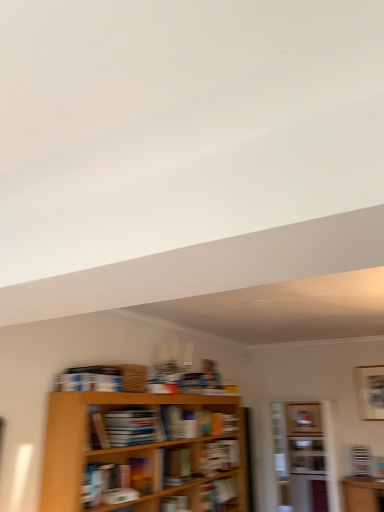
Question: From a real-world perspective, is white glossy cabinet at center located beneath hardcover book at center, which appears as the 5th book when viewed from the left?

Choices:
 (A) yes
 (B) no

Answer: (B)

Question: Is the depth of white glossy cabinet at center greater than that of hardcover book at center, placed as the 3th book when sorted from back to front?

Choices:
 (A) no
 (B) yes

Answer: (B)

Question: Does white glossy cabinet at center have a lesser height compared to hardcover book at center, which appears as the 5th book when viewed from the left?

Choices:
 (A) yes
 (B) no

Answer: (B)

Question: From the image's perspective, does white glossy cabinet at center appear lower than hardcover book at center, which appears as the 5th book when viewed from the left?

Choices:
 (A) yes
 (B) no

Answer: (A)

Question: Is white glossy cabinet at center directly adjacent to hardcover book at center, which is the fourth book from front to back?

Choices:
 (A) no
 (B) yes

Answer: (A)

Question: Is white glossy cabinet at center facing away from hardcover book at center, which is the fourth book from front to back?

Choices:
 (A) yes
 (B) no

Answer: (B)

Question: Is matte brown book at center, the 4th book positioned from the right, in front of hardcover book at center, placed as the 3th book when sorted from back to front?

Choices:
 (A) no
 (B) yes

Answer: (B)

Question: Considering the relative positions of matte brown book at center, which ranks as the 4th book in back-to-front order, and hardcover book at center, placed as the 3th book when sorted from back to front, in the image provided, is matte brown book at center, which ranks as the 4th book in back-to-front order, to the right of hardcover book at center, placed as the 3th book when sorted from back to front, from the viewer's perspective?

Choices:
 (A) yes
 (B) no

Answer: (B)

Question: Does matte brown book at center, the third book in the left-to-right sequence, contain hardcover book at center, which ranks as the 2th book in right-to-left order?

Choices:
 (A) yes
 (B) no

Answer: (B)

Question: Is matte brown book at center, the third book in the left-to-right sequence, taller than hardcover book at center, which ranks as the 2th book in right-to-left order?

Choices:
 (A) no
 (B) yes

Answer: (B)

Question: Considering the relative sizes of matte brown book at center, which appears as the third book when viewed from the front, and hardcover book at center, which is the fourth book from front to back, in the image provided, is matte brown book at center, which appears as the third book when viewed from the front, bigger than hardcover book at center, which is the fourth book from front to back,?

Choices:
 (A) no
 (B) yes

Answer: (A)

Question: Is matte brown book at center, which appears as the third book when viewed from the front, positioned far away from hardcover book at center, placed as the 3th book when sorted from back to front?

Choices:
 (A) no
 (B) yes

Answer: (A)

Question: Is hardcover book at center, arranged as the first book when viewed from the front, completely or partially outside of matte brown book at center, which appears as the third book when viewed from the front?

Choices:
 (A) yes
 (B) no

Answer: (A)